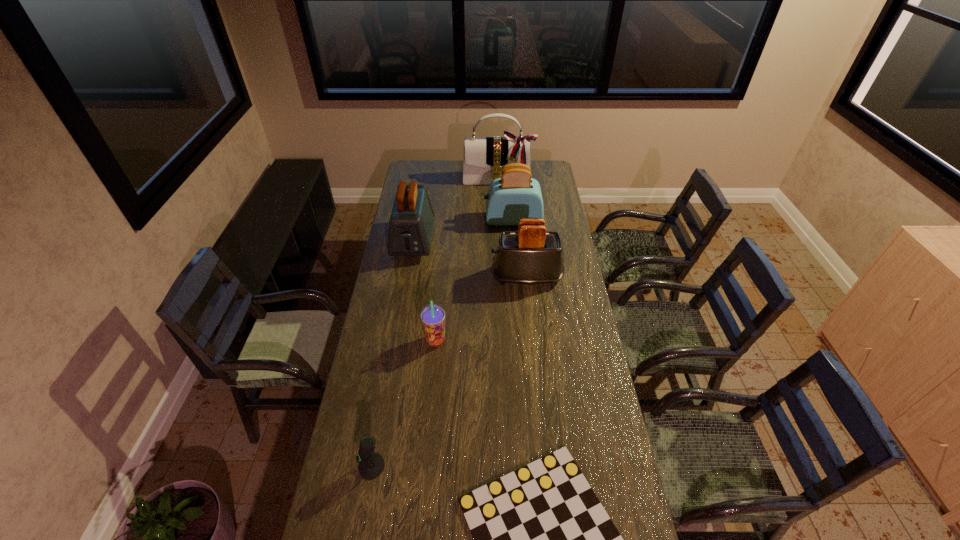
The width and height of the screenshot is (960, 540). I want to click on object situated at the far edge, so click(484, 157).

Identify the location of toaster at the left edge. (411, 222).

This screenshot has height=540, width=960. I want to click on microphone at the left edge, so click(x=371, y=465).

This screenshot has width=960, height=540. What are the coordinates of `satchel located at the right edge` in the screenshot? It's located at (484, 157).

I want to click on object positioned at the far right corner, so click(484, 157).

The image size is (960, 540). What are the coordinates of `vacant space at the far edge of the desktop` in the screenshot? It's located at (460, 179).

This screenshot has height=540, width=960. In the image, there is a desktop. Find the location of `free space at the left edge`. free space at the left edge is located at coordinates (392, 364).

The width and height of the screenshot is (960, 540). In the image, there is a desktop. Identify the location of vacant space at the right edge. (573, 364).

Locate an element on the screen. The image size is (960, 540). vacant area that lies between the third shortest object and the microphone is located at coordinates (403, 403).

The width and height of the screenshot is (960, 540). What are the coordinates of `object that is the fourth closest one to the smoothie` in the screenshot? It's located at (371, 465).